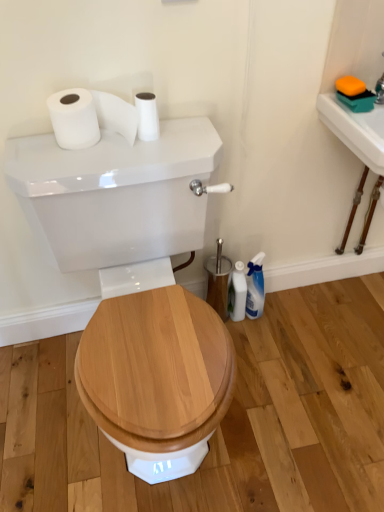
Find the location of `free space to the left of white matte toilet paper at upper left, which appears as the first toilet paper when viewed from the left`. free space to the left of white matte toilet paper at upper left, which appears as the first toilet paper when viewed from the left is located at coordinates (31, 151).